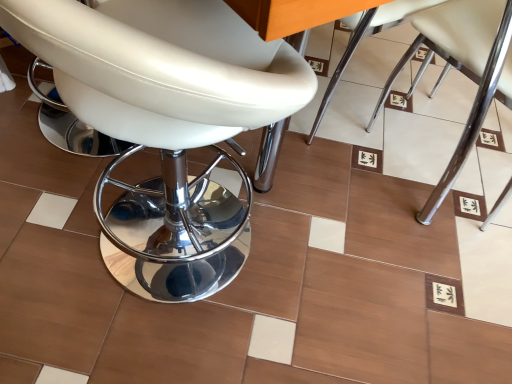
This screenshot has width=512, height=384. I want to click on vacant region to the left of white leather stool at left, which appears as the third chair when viewed from the right, so click(46, 200).